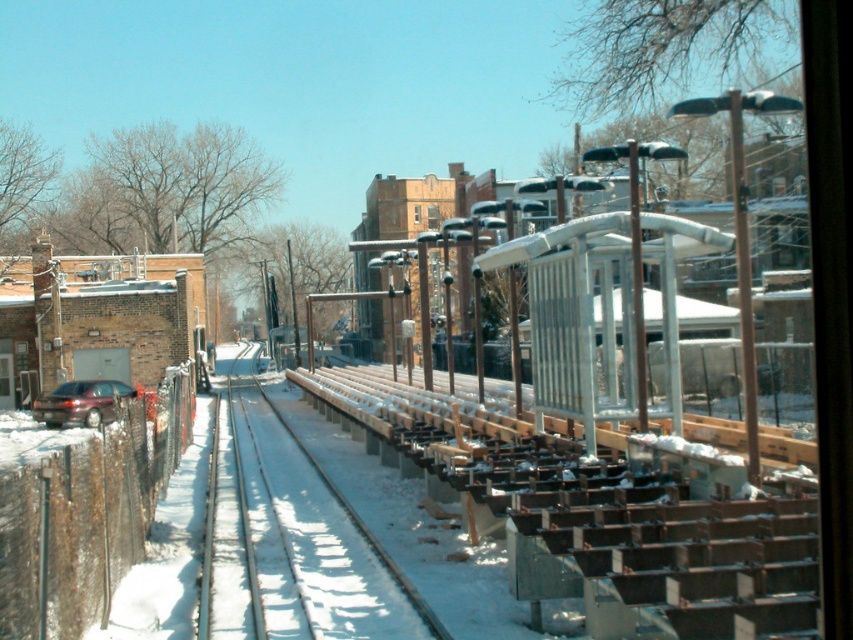
Question: Does wooden bench at center appear under matte dark brown car at left?

Choices:
 (A) no
 (B) yes

Answer: (B)

Question: Is wooden bench at center wider than matte dark brown car at left?

Choices:
 (A) yes
 (B) no

Answer: (A)

Question: Which point appears farthest from the camera in this image?

Choices:
 (A) (33, 408)
 (B) (247, 442)

Answer: (A)

Question: Which point appears farthest from the camera in this image?

Choices:
 (A) (259, 499)
 (B) (106, 412)

Answer: (B)

Question: Is wooden bench at center to the right of matte dark brown car at left from the viewer's perspective?

Choices:
 (A) yes
 (B) no

Answer: (A)